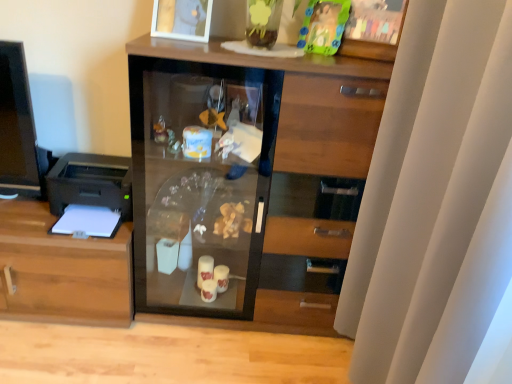
Question: Is wooden cabinet at left smaller than white glossy picture frame at upper center?

Choices:
 (A) yes
 (B) no

Answer: (B)

Question: Are wooden cabinet at left and white glossy picture frame at upper center making contact?

Choices:
 (A) no
 (B) yes

Answer: (A)

Question: From the image's perspective, is wooden cabinet at left under white glossy picture frame at upper center?

Choices:
 (A) yes
 (B) no

Answer: (A)

Question: Is wooden cabinet at left positioned with its back to white glossy picture frame at upper center?

Choices:
 (A) yes
 (B) no

Answer: (B)

Question: Is wooden cabinet at left further to camera compared to white glossy picture frame at upper center?

Choices:
 (A) no
 (B) yes

Answer: (B)

Question: Considering the relative sizes of wooden cabinet at left and white glossy picture frame at upper center in the image provided, is wooden cabinet at left taller than white glossy picture frame at upper center?

Choices:
 (A) no
 (B) yes

Answer: (B)

Question: Can you confirm if white glossy picture frame at upper center is taller than translucent plastic toy at upper center?

Choices:
 (A) no
 (B) yes

Answer: (B)

Question: Does white glossy picture frame at upper center have a lesser width compared to translucent plastic toy at upper center?

Choices:
 (A) no
 (B) yes

Answer: (A)

Question: Is white glossy picture frame at upper center positioned beyond the bounds of translucent plastic toy at upper center?

Choices:
 (A) yes
 (B) no

Answer: (A)

Question: Is white glossy picture frame at upper center facing away from translucent plastic toy at upper center?

Choices:
 (A) no
 (B) yes

Answer: (A)

Question: Does white glossy picture frame at upper center have a smaller size compared to translucent plastic toy at upper center?

Choices:
 (A) yes
 (B) no

Answer: (B)

Question: Does white glossy picture frame at upper center have a greater width compared to translucent plastic toy at upper center?

Choices:
 (A) yes
 (B) no

Answer: (A)

Question: Is black plastic printer at left smaller than white glossy picture frame at upper center?

Choices:
 (A) no
 (B) yes

Answer: (A)